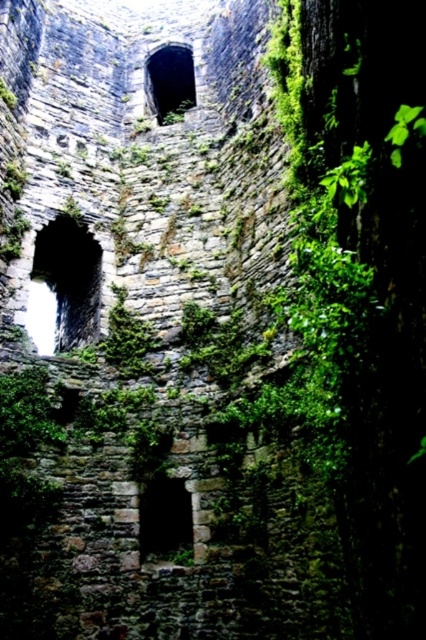
You are an architect examining the ancient stone structure. You notice two windows in the wall. The dark stone window at center and the green mossy stone window at upper center. Which window takes up more space in the wall?

The green mossy stone window at upper center takes up more space in the wall than the dark stone window at center because the dark stone window at center occupies less space than green mossy stone window at upper center.

You are standing inside an ancient stone structure and want to locate the dark stone window at left. According to the coordinates given, where should you look?

The dark stone window at left is located at point (x=63, y=285).